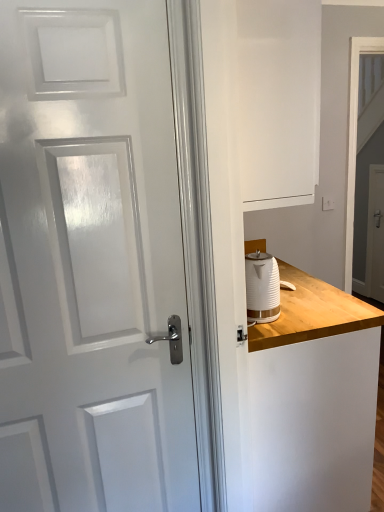
Question: Considering the relative positions of white matte dresser at right and white glossy screen door at right, arranged as the 1th screen door when viewed from the right, in the image provided, is white matte dresser at right to the right of white glossy screen door at right, arranged as the 1th screen door when viewed from the right, from the viewer's perspective?

Choices:
 (A) no
 (B) yes

Answer: (A)

Question: Does white matte dresser at right lie behind white glossy screen door at right, arranged as the 1th screen door when viewed from the right?

Choices:
 (A) yes
 (B) no

Answer: (B)

Question: From the image's perspective, is white matte dresser at right under white glossy screen door at right, arranged as the 1th screen door when viewed from the right?

Choices:
 (A) yes
 (B) no

Answer: (A)

Question: From a real-world perspective, is white matte dresser at right located beneath white glossy screen door at right, acting as the first screen door starting from the back?

Choices:
 (A) no
 (B) yes

Answer: (A)

Question: Does white matte dresser at right have a lesser height compared to white glossy screen door at right, arranged as the 1th screen door when viewed from the right?

Choices:
 (A) yes
 (B) no

Answer: (B)

Question: Considering the relative sizes of white matte dresser at right and white glossy screen door at right, acting as the first screen door starting from the back, in the image provided, is white matte dresser at right wider than white glossy screen door at right, acting as the first screen door starting from the back,?

Choices:
 (A) no
 (B) yes

Answer: (B)

Question: Can you confirm if white glossy screen door at upper right, marked as the first screen door in a front-to-back arrangement, is thinner than white glossy screen door at right, arranged as the 1th screen door when viewed from the right?

Choices:
 (A) no
 (B) yes

Answer: (A)

Question: Is white glossy screen door at upper right, the second screen door positioned from the back, positioned behind white glossy screen door at right, which appears as the 2th screen door when viewed from the front?

Choices:
 (A) yes
 (B) no

Answer: (B)

Question: Does white glossy screen door at upper right, positioned as the second screen door in right-to-left order, appear on the right side of white glossy screen door at right, acting as the first screen door starting from the back?

Choices:
 (A) no
 (B) yes

Answer: (A)

Question: Is white glossy screen door at upper right, the second screen door positioned from the back, bigger than white glossy screen door at right, the second screen door viewed from the left?

Choices:
 (A) yes
 (B) no

Answer: (A)

Question: From the image's perspective, would you say white glossy screen door at upper right, the second screen door positioned from the back, is positioned over white glossy screen door at right, arranged as the 1th screen door when viewed from the right?

Choices:
 (A) no
 (B) yes

Answer: (B)

Question: Considering the relative positions of white glossy screen door at upper right, positioned as the second screen door in right-to-left order, and white glossy screen door at right, acting as the first screen door starting from the back, in the image provided, is white glossy screen door at upper right, positioned as the second screen door in right-to-left order, to the left of white glossy screen door at right, acting as the first screen door starting from the back, from the viewer's perspective?

Choices:
 (A) no
 (B) yes

Answer: (B)

Question: Is white ribbed kettle at right bigger than white matte dresser at right?

Choices:
 (A) no
 (B) yes

Answer: (A)